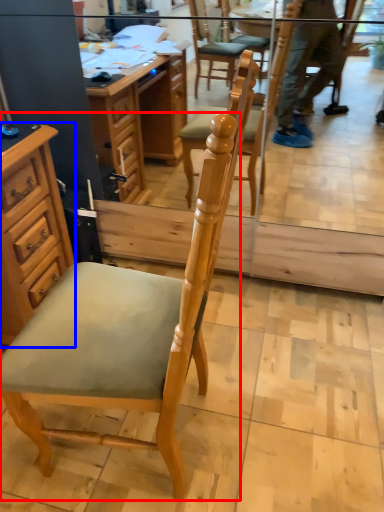
Question: Which object appears farthest to the camera in this image, chair (highlighted by a red box) or cabinetry (highlighted by a blue box)?

Choices:
 (A) chair
 (B) cabinetry

Answer: (B)